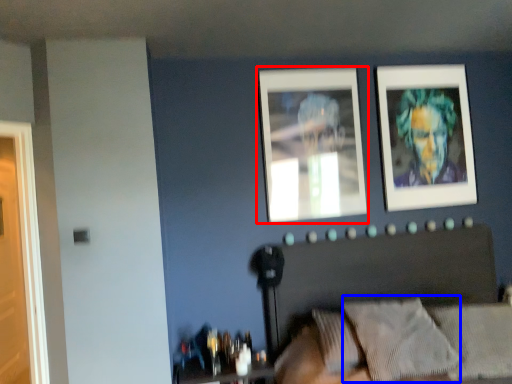
Question: Which of the following is the closest to the observer, picture frame (highlighted by a red box) or pillow (highlighted by a blue box)?

Choices:
 (A) picture frame
 (B) pillow

Answer: (B)